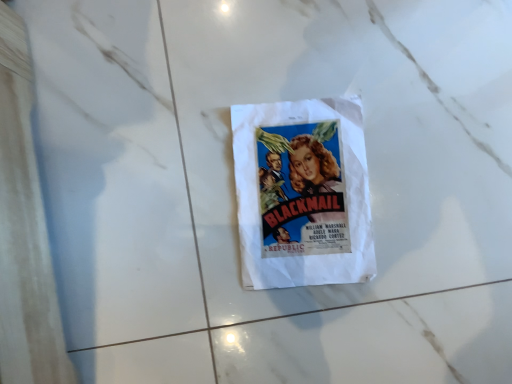
Locate an element on the screen. free spot above matte paper poster at center (from a real-world perspective) is located at coordinates click(x=291, y=179).